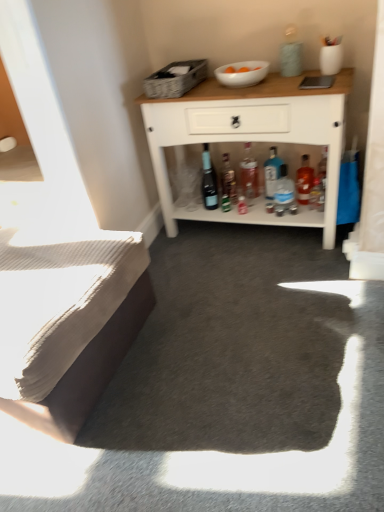
Image resolution: width=384 pixels, height=512 pixels. What are the coordinates of `vacant area to the left of white glossy bowl at upper center` in the screenshot? It's located at (202, 89).